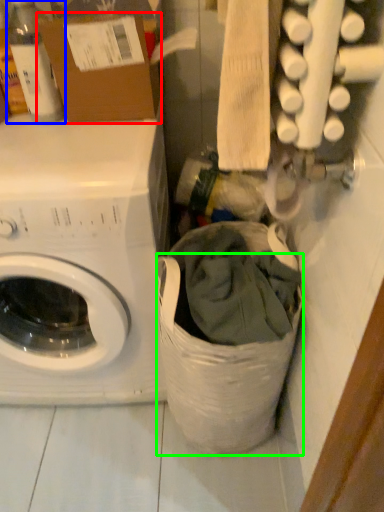
Question: Considering the real-world distances, which object is farthest from cardboard box (highlighted by a red box)? bottle (highlighted by a blue box) or laundry basket (highlighted by a green box)?

Choices:
 (A) bottle
 (B) laundry basket

Answer: (B)